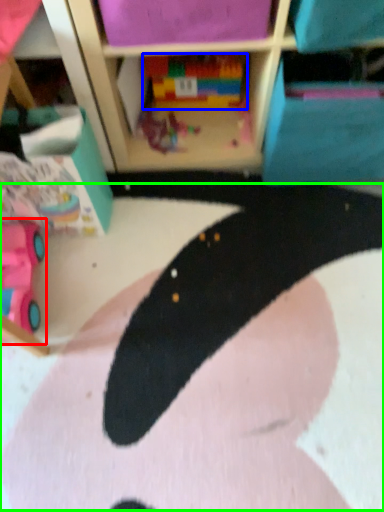
Question: Which is nearer to the toy (highlighted by a red box)? toy (highlighted by a blue box) or animal (highlighted by a green box).

Choices:
 (A) toy
 (B) animal

Answer: (B)